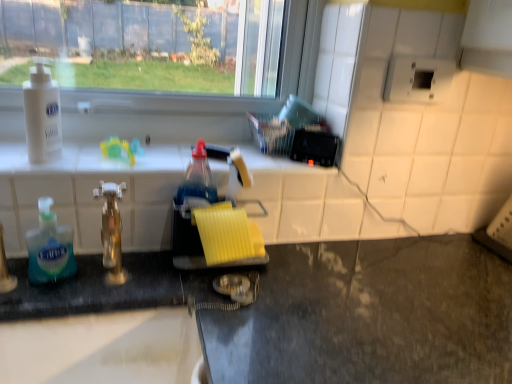
Question: Is gold metallic faucet at center located within translucent plastic soap dispenser at left, arranged as the 1th bottle when ordered from the bottom?

Choices:
 (A) no
 (B) yes

Answer: (A)

Question: Can you confirm if translucent plastic soap dispenser at left, the 2th bottle positioned from the top, is shorter than gold metallic faucet at center?

Choices:
 (A) no
 (B) yes

Answer: (B)

Question: Can you confirm if translucent plastic soap dispenser at left, arranged as the 1th bottle when ordered from the bottom, is bigger than gold metallic faucet at center?

Choices:
 (A) yes
 (B) no

Answer: (B)

Question: Is translucent plastic soap dispenser at left, arranged as the 1th bottle when ordered from the bottom, placed right next to gold metallic faucet at center?

Choices:
 (A) no
 (B) yes

Answer: (A)

Question: Is translucent plastic soap dispenser at left, the 2th bottle positioned from the top, facing away from gold metallic faucet at center?

Choices:
 (A) yes
 (B) no

Answer: (B)

Question: Is gold metallic faucet at center wider or thinner than white matte lotion at upper left, which ranks as the 2th bottle in bottom-to-top order?

Choices:
 (A) wide
 (B) thin

Answer: (A)

Question: Do you think gold metallic faucet at center is within white matte lotion at upper left, arranged as the first bottle when viewed from the top, or outside of it?

Choices:
 (A) inside
 (B) outside

Answer: (B)

Question: Considering the positions of gold metallic faucet at center and white matte lotion at upper left, arranged as the first bottle when viewed from the top, in the image, is gold metallic faucet at center taller or shorter than white matte lotion at upper left, arranged as the first bottle when viewed from the top,?

Choices:
 (A) short
 (B) tall

Answer: (B)

Question: Is point 117,246 closer or farther from the camera than point 35,59?

Choices:
 (A) farther
 (B) closer

Answer: (B)

Question: Is gold metallic faucet at center taller or shorter than black granite counter at lower left?

Choices:
 (A) tall
 (B) short

Answer: (B)

Question: In terms of size, does gold metallic faucet at center appear bigger or smaller than black granite counter at lower left?

Choices:
 (A) small
 (B) big

Answer: (A)

Question: From a real-world perspective, is gold metallic faucet at center positioned above or below black granite counter at lower left?

Choices:
 (A) above
 (B) below

Answer: (A)

Question: Is gold metallic faucet at center to the left or to the right of black granite counter at lower left in the image?

Choices:
 (A) left
 (B) right

Answer: (A)

Question: From the image's perspective, is yellow sponge at center located above or below gold metallic faucet at center?

Choices:
 (A) below
 (B) above

Answer: (B)

Question: Considering the positions of yellow sponge at center and gold metallic faucet at center in the image, is yellow sponge at center bigger or smaller than gold metallic faucet at center?

Choices:
 (A) small
 (B) big

Answer: (B)